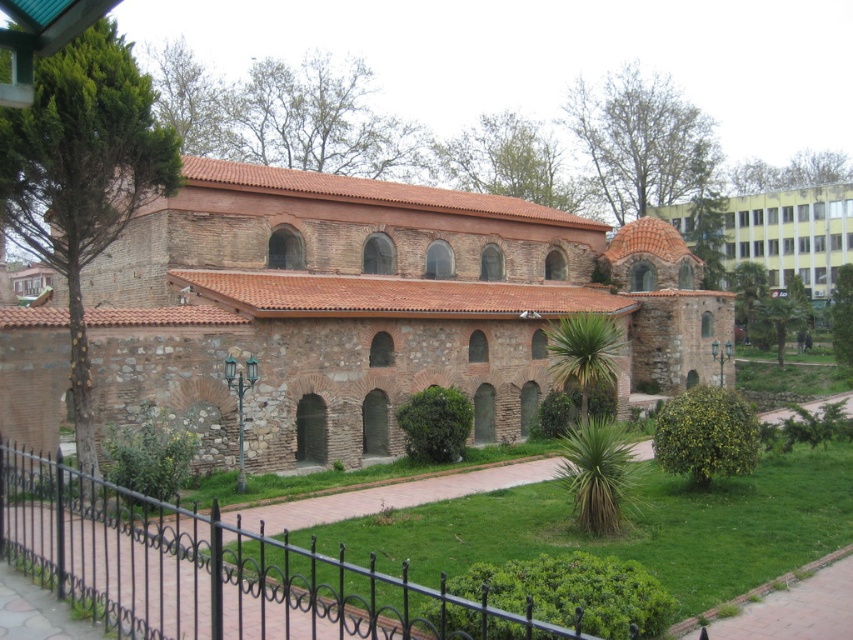
Which is below, brown stone chapel at center or black wrought iron fence at lower left?

Positioned lower is black wrought iron fence at lower left.

Which of these two, brown stone chapel at center or black wrought iron fence at lower left, stands taller?

brown stone chapel at center

This screenshot has width=853, height=640. Describe the element at coordinates (372, 308) in the screenshot. I see `brown stone chapel at center` at that location.

I want to click on brown stone chapel at center, so click(x=372, y=308).